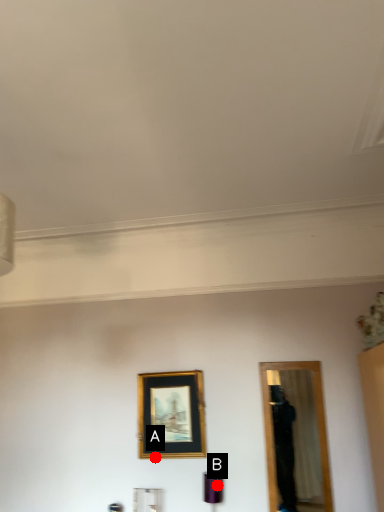
Question: Two points are circled on the image, labeled by A and B beside each circle. Which of the following is the farthest from the observer?

Choices:
 (A) A is further
 (B) B is further

Answer: (A)